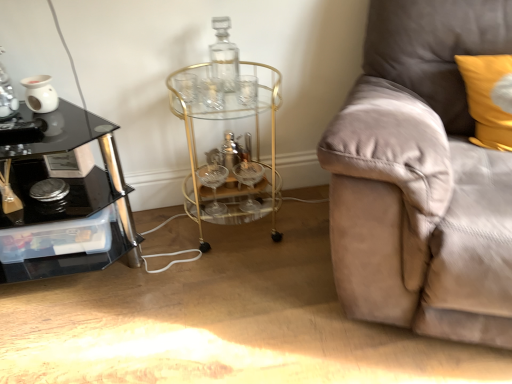
Question: Does transparent glass bottle at center have a greater width compared to black glass table at left?

Choices:
 (A) no
 (B) yes

Answer: (A)

Question: From a real-world perspective, does transparent glass bottle at center stand above black glass table at left?

Choices:
 (A) no
 (B) yes

Answer: (B)

Question: Considering the relative sizes of transparent glass bottle at center and black glass table at left in the image provided, is transparent glass bottle at center bigger than black glass table at left?

Choices:
 (A) yes
 (B) no

Answer: (B)

Question: Considering the relative positions of transparent glass bottle at center and black glass table at left in the image provided, is transparent glass bottle at center to the right of black glass table at left from the viewer's perspective?

Choices:
 (A) no
 (B) yes

Answer: (B)

Question: Can you confirm if transparent glass bottle at center is thinner than black glass table at left?

Choices:
 (A) no
 (B) yes

Answer: (B)

Question: Does transparent glass bottle at center touch black glass table at left?

Choices:
 (A) no
 (B) yes

Answer: (A)

Question: From a real-world perspective, is yellow fabric pillow at upper right under transparent glass bottle at center?

Choices:
 (A) yes
 (B) no

Answer: (A)

Question: Is yellow fabric pillow at upper right touching transparent glass bottle at center?

Choices:
 (A) yes
 (B) no

Answer: (B)

Question: From the image's perspective, is yellow fabric pillow at upper right beneath transparent glass bottle at center?

Choices:
 (A) yes
 (B) no

Answer: (A)

Question: Is yellow fabric pillow at upper right facing towards transparent glass bottle at center?

Choices:
 (A) yes
 (B) no

Answer: (B)

Question: Is yellow fabric pillow at upper right closer to camera compared to transparent glass bottle at center?

Choices:
 (A) yes
 (B) no

Answer: (A)

Question: Is yellow fabric pillow at upper right not within transparent glass bottle at center?

Choices:
 (A) yes
 (B) no

Answer: (A)

Question: Is the surface of black glass table at left in direct contact with yellow fabric pillow at upper right?

Choices:
 (A) no
 (B) yes

Answer: (A)